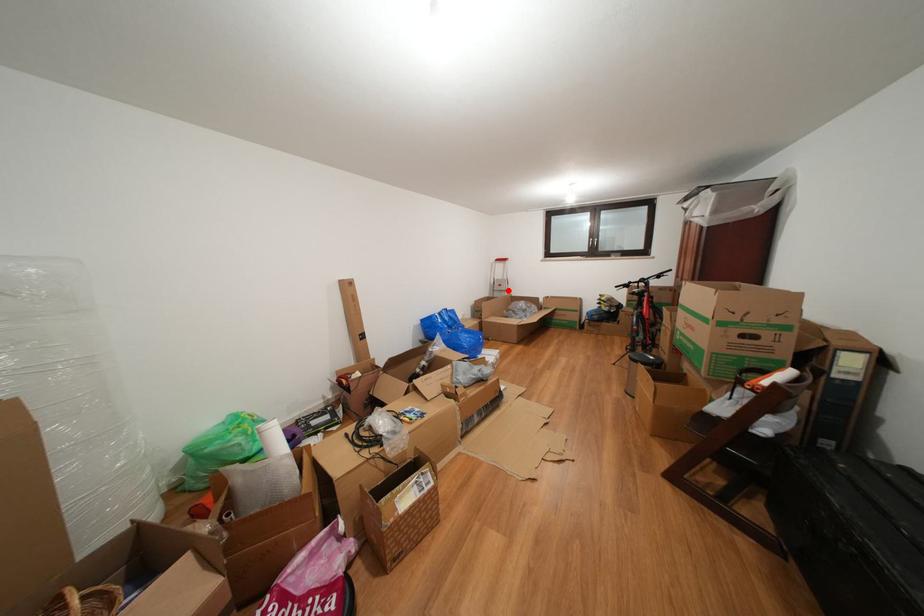
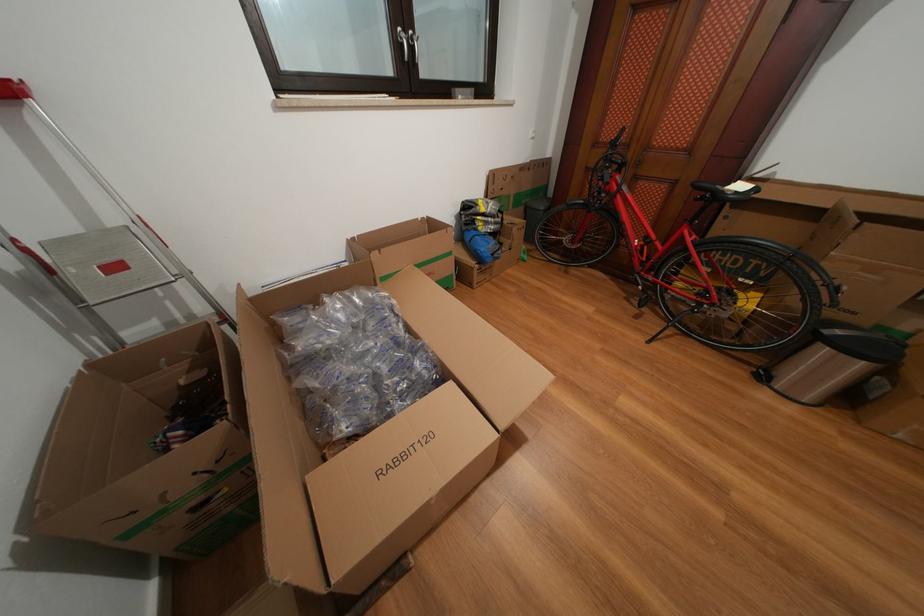
The point at the highlighted location is marked in the first image. Where is the corresponding point in the second image?

(124, 273)